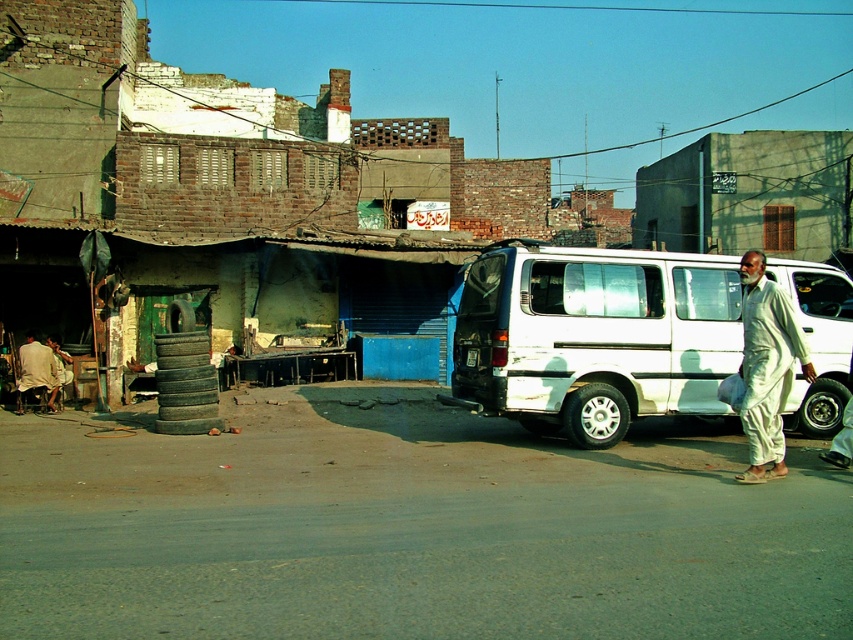
Question: In this image, where is white cotton pants at right located relative to light brown fabric shirt at lower left?

Choices:
 (A) right
 (B) left

Answer: (A)

Question: Based on their relative distances, which object is nearer to the light brown fabric shirt at lower left?

Choices:
 (A) light beige fabric at lower left
 (B) white matte van at right

Answer: (A)

Question: In this image, where is green concrete wall at upper right located relative to white cotton pants at right?

Choices:
 (A) above
 (B) below

Answer: (A)

Question: Observing the image, what is the correct spatial positioning of white matte van at center in reference to light beige fabric at lower left?

Choices:
 (A) right
 (B) left

Answer: (A)

Question: Based on their relative distances, which object is farther from the white cotton pants at right?

Choices:
 (A) light brown fabric shirt at lower left
 (B) white matte van at center
 (C) light beige fabric at lower left

Answer: (C)

Question: Which object is closer to the camera taking this photo?

Choices:
 (A) green concrete wall at upper right
 (B) light beige fabric at lower left
 (C) white cotton pants at right
 (D) light brown fabric shirt at lower left

Answer: (C)